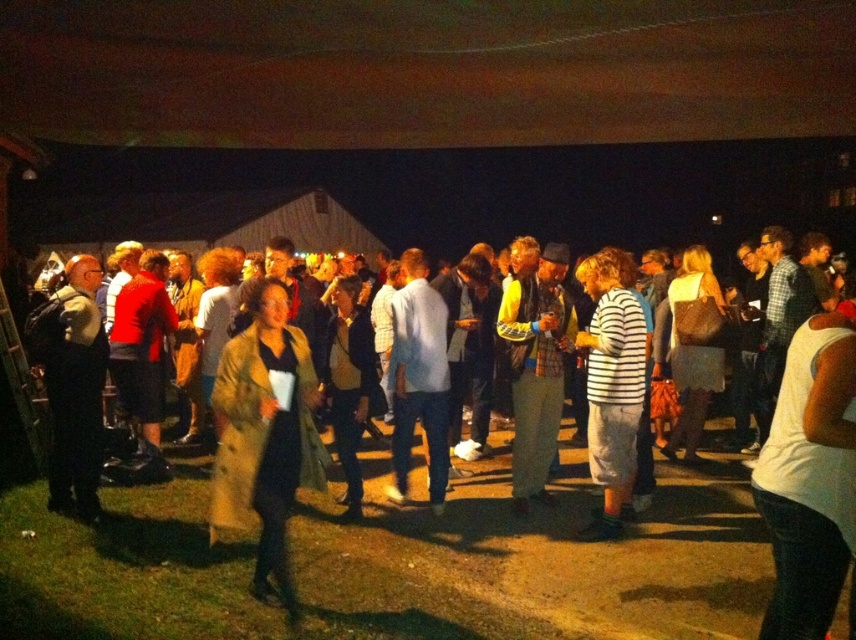
You are at a nighttime event and see two people wearing a tan textured coat at center and a white striped shirt at center. Which clothing item is positioned more to the left?

The tan textured coat at center is positioned to the left of the white striped shirt at center, so the tan textured coat at center is more to the left.